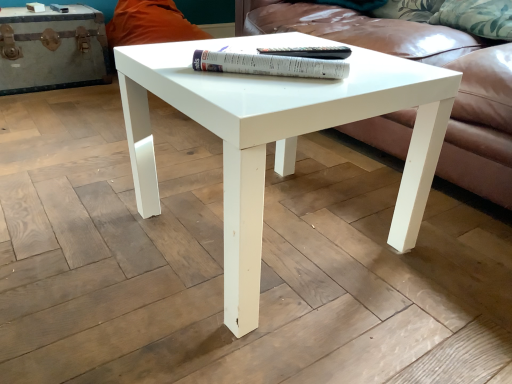
Where is `free space in front of white glossy coffee table at center`? This screenshot has width=512, height=384. free space in front of white glossy coffee table at center is located at coordinates (265, 334).